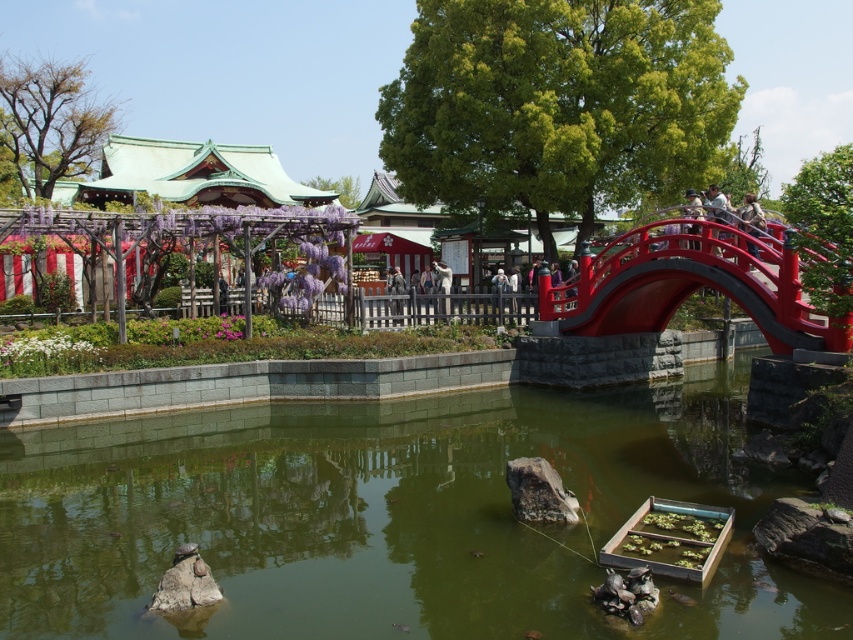
Question: Is glossy wood bridge at center right smaller than camouflage jacket at upper right?

Choices:
 (A) no
 (B) yes

Answer: (B)

Question: Can you confirm if glossy wood bridge at center right is thinner than camouflage jacket at upper right?

Choices:
 (A) no
 (B) yes

Answer: (B)

Question: Can you confirm if green stone wall at center is positioned to the left of camouflage jacket at upper right?

Choices:
 (A) yes
 (B) no

Answer: (A)

Question: Among these objects, which one is nearest to the camera?

Choices:
 (A) greenish water at pond center
 (B) green stone wall at center
 (C) camouflage jacket at upper right

Answer: (A)

Question: Which of the following is the closest to the observer?

Choices:
 (A) (3, 340)
 (B) (323, 476)

Answer: (B)

Question: Considering the real-world distances, which object is closest to the greenish water at pond center?

Choices:
 (A) green stone wall at center
 (B) camouflage jacket at upper right
 (C) glossy wood bridge at center right

Answer: (A)